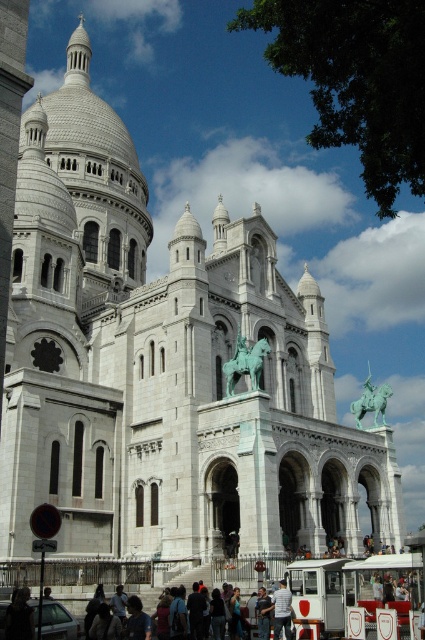
You are a tourist standing in front of the Basilica of the Sacred Heart of Paris. You notice two objects in the scene described as dark blue jeans at lower center and green patinated metal horseman at center. Which object appears smaller in the image?

The dark blue jeans at lower center appears smaller than the green patinated metal horseman at center in the image.

You are a tourist standing in front of the Basilica of the Sacred Heart of Paris. You notice a green patina statue at center and a white cotton shirt at center. Which object is taller?

The green patina statue at center is much taller than the white cotton shirt at center.

Consider the image. You are a tourist standing in front of the Basilica of the Sacred Heart of Paris. You notice a green patina statue at center and a white cotton shirt at center. Which object is positioned to the left when viewed from your perspective?

The green patina statue at center is to the left of the white cotton shirt at center from the tourist perspective.